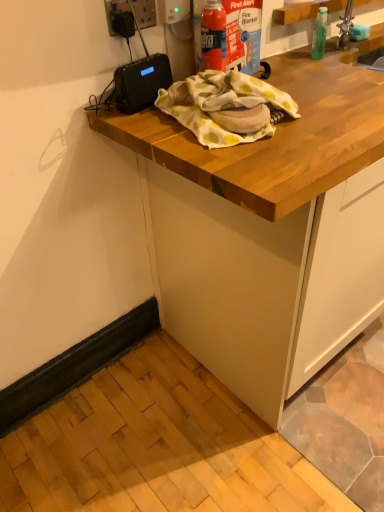
Question: Should I look upward or downward to see black plastic electric outlet at upper left?

Choices:
 (A) up
 (B) down

Answer: (A)

Question: From a real-world perspective, is black plastic electric outlet at upper left located beneath wooden countertop at upper center?

Choices:
 (A) no
 (B) yes

Answer: (A)

Question: Is black plastic electric outlet at upper left positioned far away from wooden countertop at upper center?

Choices:
 (A) yes
 (B) no

Answer: (B)

Question: Does black plastic electric outlet at upper left have a lesser width compared to wooden countertop at upper center?

Choices:
 (A) no
 (B) yes

Answer: (B)

Question: Can you confirm if black plastic electric outlet at upper left is smaller than wooden countertop at upper center?

Choices:
 (A) yes
 (B) no

Answer: (A)

Question: From the image's perspective, is black plastic electric outlet at upper left located beneath wooden countertop at upper center?

Choices:
 (A) yes
 (B) no

Answer: (B)

Question: Does black plastic electric outlet at upper left have a larger size compared to wooden countertop at upper center?

Choices:
 (A) yes
 (B) no

Answer: (B)

Question: From a real-world perspective, is wooden countertop at upper center positioned under black plastic electric outlet at upper left based on gravity?

Choices:
 (A) yes
 (B) no

Answer: (A)

Question: Does wooden countertop at upper center touch black plastic electric outlet at upper left?

Choices:
 (A) yes
 (B) no

Answer: (B)

Question: From a real-world perspective, is wooden countertop at upper center on black plastic electric outlet at upper left?

Choices:
 (A) yes
 (B) no

Answer: (B)

Question: Considering the relative positions of wooden countertop at upper center and black plastic electric outlet at upper left in the image provided, is wooden countertop at upper center in front of black plastic electric outlet at upper left?

Choices:
 (A) yes
 (B) no

Answer: (A)

Question: Does wooden countertop at upper center have a lesser height compared to black plastic electric outlet at upper left?

Choices:
 (A) no
 (B) yes

Answer: (A)

Question: Is wooden countertop at upper center positioned far away from black plastic electric outlet at upper left?

Choices:
 (A) no
 (B) yes

Answer: (A)

Question: In the image, is wooden countertop at upper center on the left side or the right side of black plastic electric outlet at upper left?

Choices:
 (A) left
 (B) right

Answer: (B)